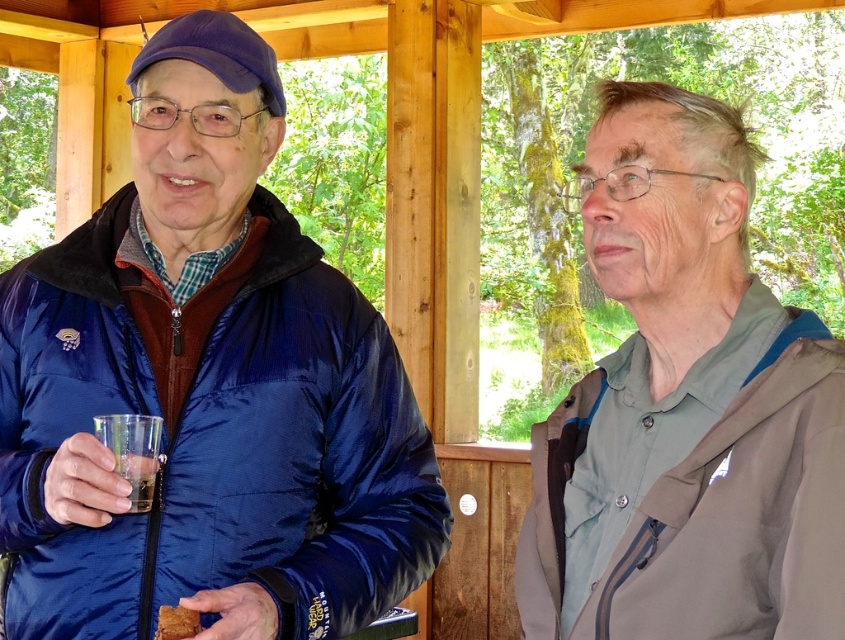
Question: Which object is farther from the camera taking this photo?

Choices:
 (A) blue quilted jacket at center
 (B) brown crumbly bread at lower left
 (C) clear plastic cup at left

Answer: (C)

Question: Does blue quilted jacket at center have a larger size compared to brown crumbly bread at lower left?

Choices:
 (A) no
 (B) yes

Answer: (B)

Question: Which of the following is the closest to the observer?

Choices:
 (A) blue quilted jacket at center
 (B) gray matte jacket at right
 (C) clear plastic cup at left
 (D) brown crumbly bread at lower left

Answer: (B)

Question: Does gray matte jacket at right have a greater width compared to clear plastic cup at left?

Choices:
 (A) no
 (B) yes

Answer: (B)

Question: Considering the relative positions of blue quilted jacket at center and brown crumbly bread at lower left in the image provided, where is blue quilted jacket at center located with respect to brown crumbly bread at lower left?

Choices:
 (A) left
 (B) right

Answer: (A)

Question: Which point appears farthest from the camera in this image?

Choices:
 (A) (277, 611)
 (B) (150, 504)
 (C) (571, 538)
 (D) (176, 627)

Answer: (A)